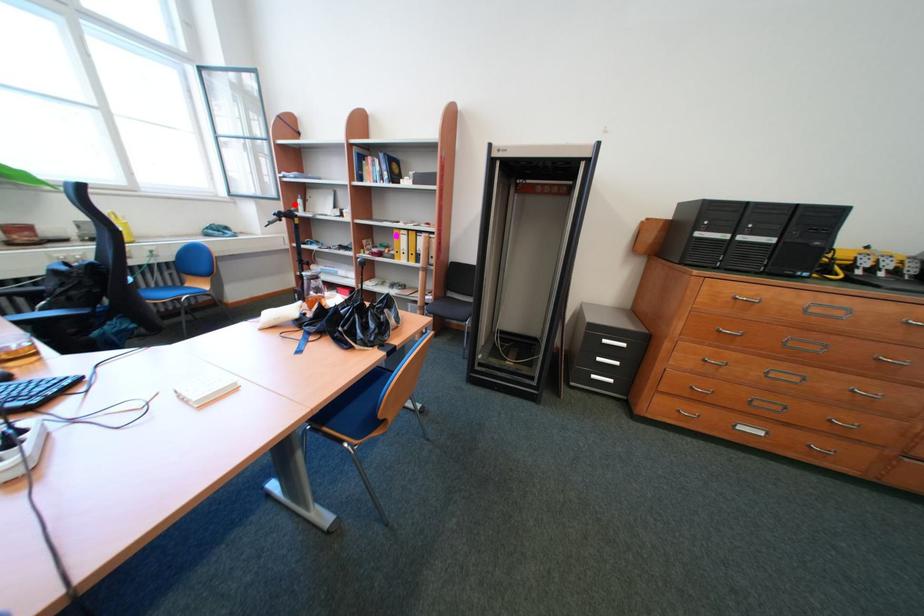
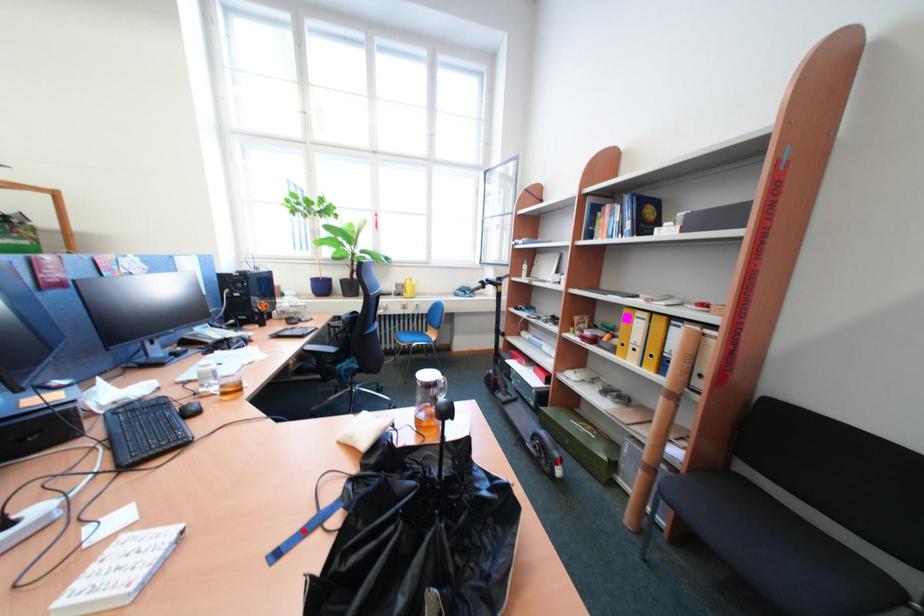
I am providing you with two images of the same scene from different viewpoints. A red point is marked on the first image and another point is marked on the second image. Is the red point in image1 aligned with the point shown in image2?

No